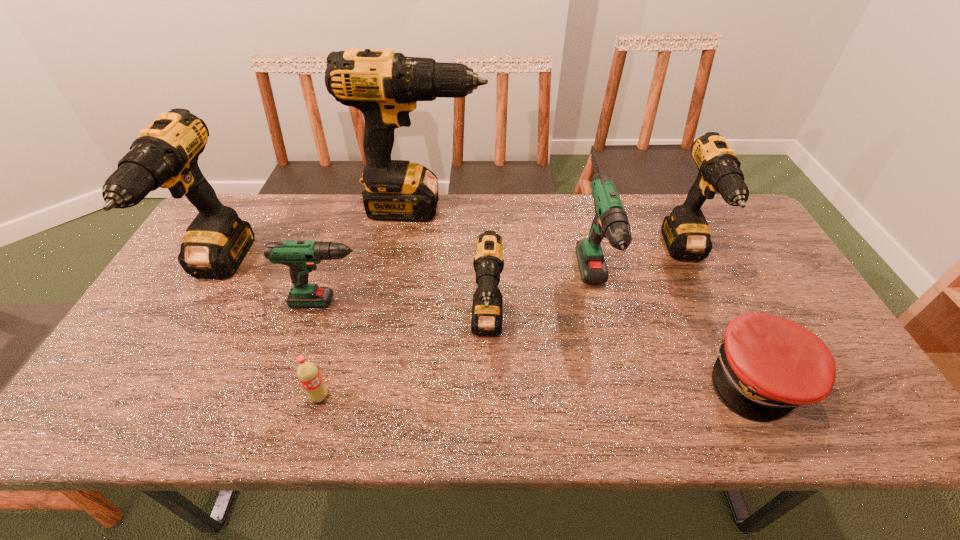
You are a GUI agent. You are given a task and a screenshot of the screen. Output one action in this format:
    pyautogui.click(x=<x>, y=<y>)
    Task: Click on the vacant space at the left edge
    
    Given the screenshot: What is the action you would take?
    pyautogui.click(x=141, y=374)

In the image, there is a desktop. Where is `vacant space at the right edge`? vacant space at the right edge is located at coordinates (754, 284).

In the image, there is a desktop. Identify the location of vacant space at the near left corner. This screenshot has width=960, height=540. (87, 411).

What are the coordinates of `blank space at the near right corner of the desktop` in the screenshot? It's located at pos(828,433).

Identify the location of free space between the sixth object from left to right and the smallest black drill. Image resolution: width=960 pixels, height=540 pixels. (541, 309).

Locate an element on the screen. The width and height of the screenshot is (960, 540). empty space between the second drill from right to left and the red cap is located at coordinates (677, 333).

At what (x,y) coordinates should I click in order to perform the action: click on unoccupied position between the leftmost drill and the left green drill. Please return your answer as a coordinate pair (x, y). The width and height of the screenshot is (960, 540). Looking at the image, I should click on (276, 286).

Identify the location of free space that is in between the smallest black drill and the rightmost drill. This screenshot has width=960, height=540. (587, 292).

Where is `free space between the shortest object and the left green drill`? This screenshot has height=540, width=960. free space between the shortest object and the left green drill is located at coordinates (547, 339).

Where is `vacant region between the second smallest black drill and the farthest drill`? vacant region between the second smallest black drill and the farthest drill is located at coordinates (555, 231).